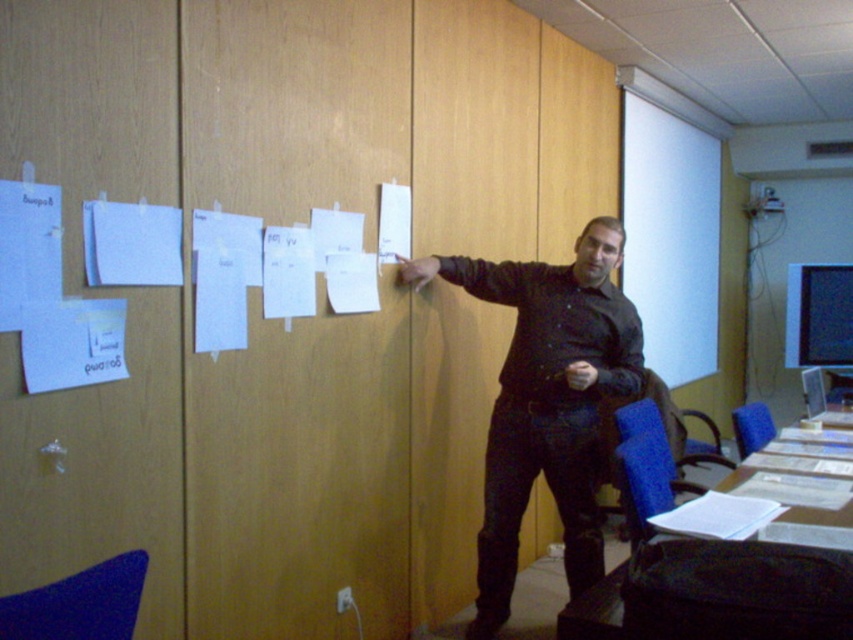
You are an attendee at a presentation and notice the black matte shirt at center and the white matte paper at upper center. From your perspective, which object is positioned to the left?

The black matte shirt at center is to the left of the white matte paper at upper center.

You are an assistant in the room and need to determine if the black matte shirt at center can be fully covered by the white matte paper at upper center when placed over it. Based on their sizes, what is your conclusion?

The black matte shirt at center has a smaller width than the white matte paper at upper center, so the white matte paper at upper center can fully cover the black matte shirt at center when placed over it.